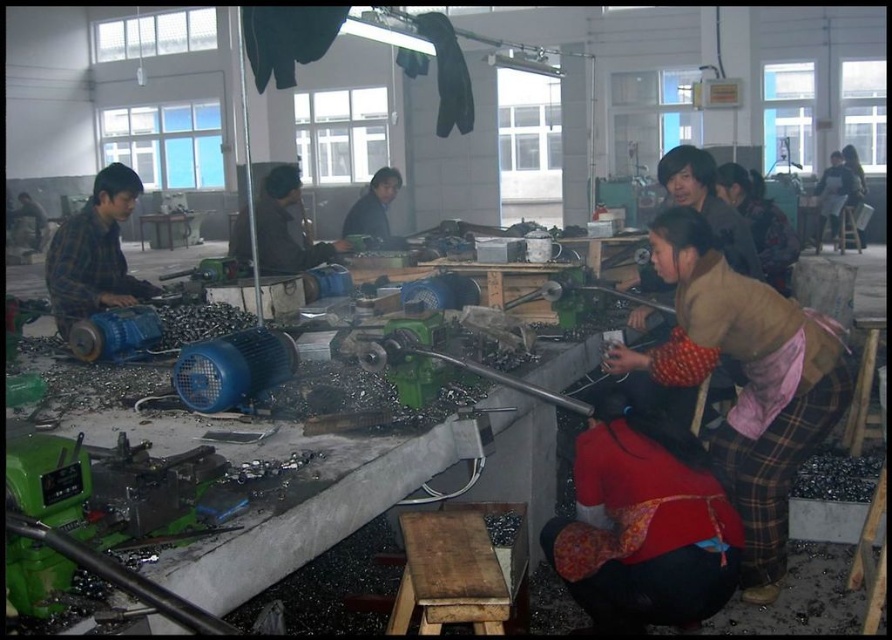
Question: Is wooden stool at lower center positioned behind plaid fabric shirt at left?

Choices:
 (A) yes
 (B) no

Answer: (B)

Question: Estimate the real-world distances between objects in this image. Which object is closer to the wooden stool at lower center?

Choices:
 (A) red fabric skirt at lower center
 (B) metallic gray tool at center
 (C) brown plaid pants at lower right
 (D) plaid fabric shirt at left

Answer: (A)

Question: Does plaid fabric shirt at left have a lesser width compared to metallic gray tool at center?

Choices:
 (A) yes
 (B) no

Answer: (B)

Question: Does plaid fabric shirt at left lie behind matte black shirt at center?

Choices:
 (A) yes
 (B) no

Answer: (B)

Question: Which object appears farthest from the camera in this image?

Choices:
 (A) plaid fabric shirt at left
 (B) brown plaid pants at lower right

Answer: (A)

Question: Estimate the real-world distances between objects in this image. Which object is farther from the metallic gray tool at center?

Choices:
 (A) plaid fabric shirt at left
 (B) wooden stool at lower center

Answer: (A)